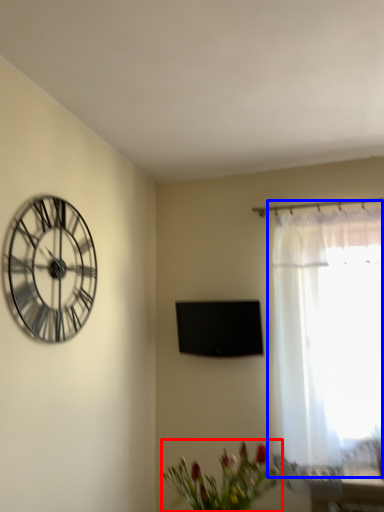
Question: Which object is closer to the camera taking this photo, floral arrangement (highlighted by a red box) or window (highlighted by a blue box)?

Choices:
 (A) floral arrangement
 (B) window

Answer: (A)